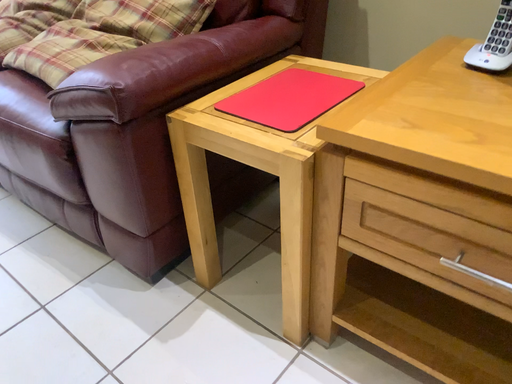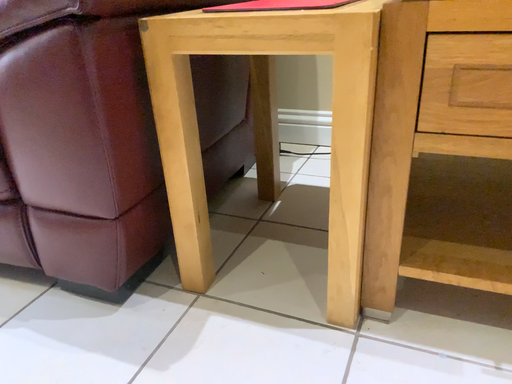
Question: Which way did the camera rotate in the video?

Choices:
 (A) rotated right
 (B) rotated left

Answer: (A)